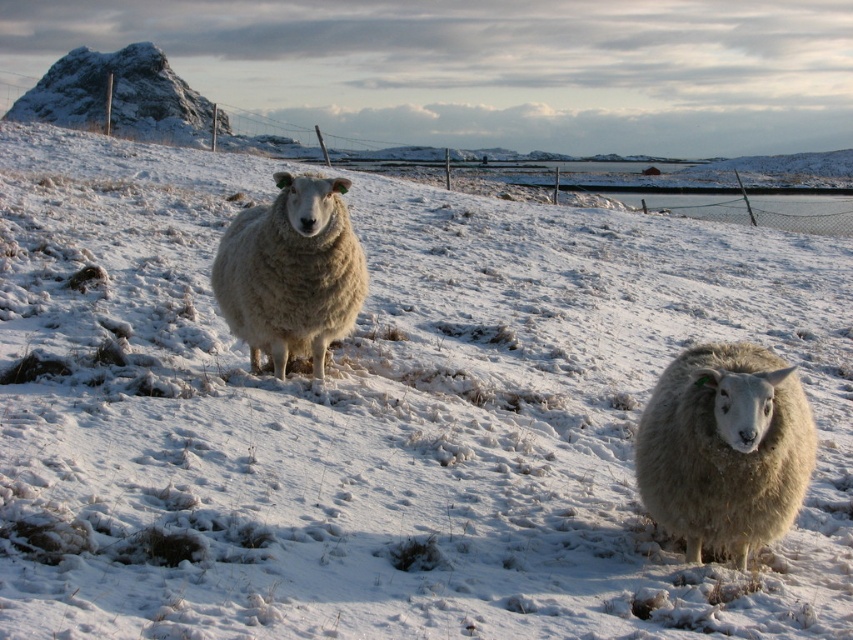
You are a photographer trying to capture the white woolly sheep at lower right. You notice a point marked at coordinates [724,449] in the image. Where is this point located relative to the white woolly sheep at lower right?

The point at coordinates [724,449] is located on the white woolly sheep at lower right.

You are a photographer trying to capture both the white woolly sheep at lower right and the white woolly sheep at center in a single photo. Based on their sizes in the image, which sheep would appear smaller in the final photograph?

The white woolly sheep at lower right would appear smaller in the final photograph because it has a lesser height compared to the white woolly sheep at center according to the description.

You are a photographer trying to capture both the white woolly sheep at lower right and the white woolly sheep at center in a single frame. Which sheep will appear smaller in your photo?

The white woolly sheep at lower right will appear smaller in the photo because it has a lesser width compared to the white woolly sheep at center.